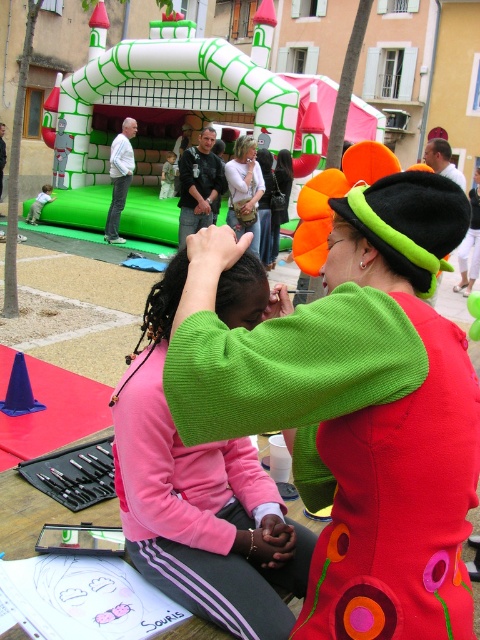
You are a photographer at the event and want to capture a photo of both the pink fleece jacket at center and the matte black hair at center in the same frame. Based on their positions, which object should you focus on first to ensure both are in the frame?

You should focus on the pink fleece jacket at center first since it is to the left of the matte black hair at center, so adjusting the camera to include the leftmost object ensures both are captured.

You are organizing a photo shoot and need to ensure that the pink fleece jacket at center and the matte black hair at center are both visible in the frame. Given their sizes, which object should you prioritize positioning closer to the camera to maintain clarity?

The pink fleece jacket at center has a smaller size compared to matte black hair at center, so you should prioritize positioning the pink fleece jacket at center closer to the camera to ensure it remains visible and clear in the photo.